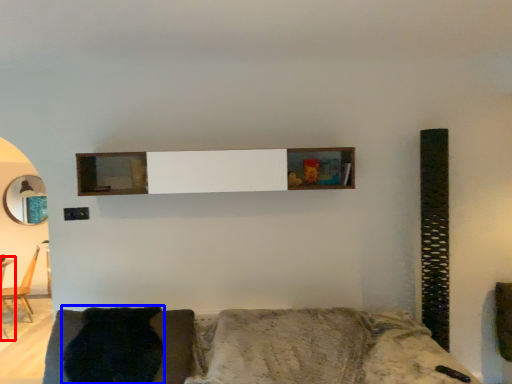
Question: Which object is further to the camera taking this photo, table (highlighted by a red box) or pillow (highlighted by a blue box)?

Choices:
 (A) table
 (B) pillow

Answer: (A)